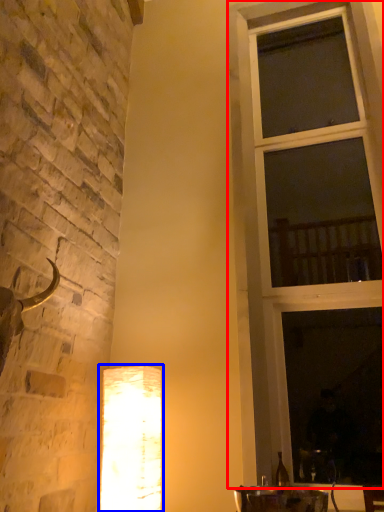
Question: Among these objects, which one is nearest to the camera, window (highlighted by a red box) or lamp (highlighted by a blue box)?

Choices:
 (A) window
 (B) lamp

Answer: (B)